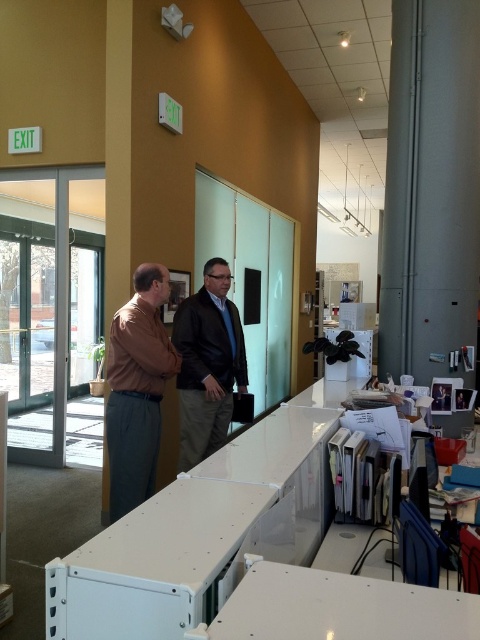
You are standing in the office and want to place a small potted plant between the two points labeled as point (149,266) and point (191,332). Since the plant needs to be placed at the midpoint between them, which point should you position it closer to?

The midpoint between point (149,266) and point (191,332) would be equidistant to both points. However, since point (149,266) is closer to the camera than point (191,332), the plant should be positioned closer to point (149,266) to maintain visual balance from the observer perspective.

You are a delivery person who needs to place a 24 inch wide package between the brown smooth shirt at center and the dark brown leather jacket at center. Can the package fit in the space between them?

The distance between the brown smooth shirt at center and the dark brown leather jacket at center is 27.92 inches. Since the package is 24 inches wide, it can fit in the space between them as there is enough room.

You are an office receptionist and need to identify the clothing items worn by the two men. Which clothing item is positioned lower on the body between the brown smooth shirt at center and the dark brown leather jacket at center?

The brown smooth shirt at center is positioned lower on the body than the dark brown leather jacket at center.